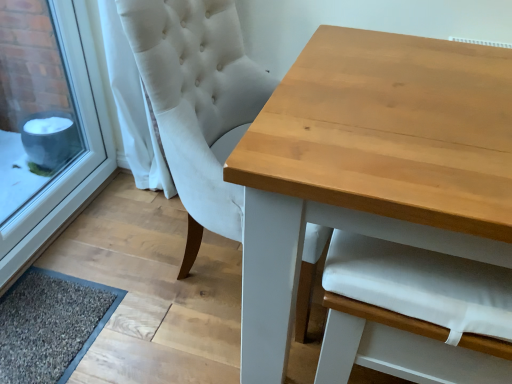
This screenshot has width=512, height=384. I want to click on vacant position to the left of white fabric chair at upper center, so [x=102, y=294].